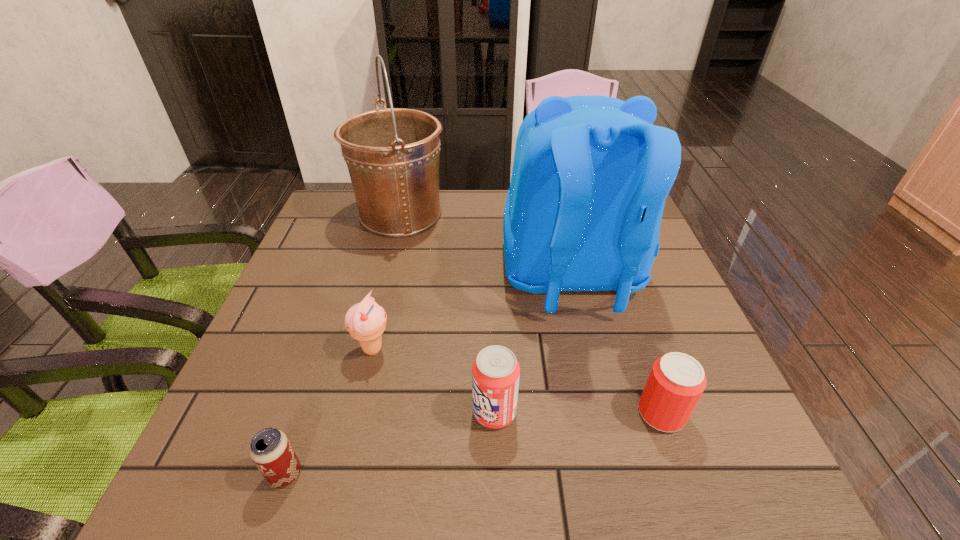
What are the coordinates of `free location located 0.260m on the front of the icecream` in the screenshot? It's located at (338, 496).

The width and height of the screenshot is (960, 540). I want to click on vacant region located 0.220m on the surface of the soda can, so click(x=353, y=412).

Identify the location of free point located on the surface of the soda can. (445, 412).

Where is `free space located on the surface of the soda can`? This screenshot has height=540, width=960. free space located on the surface of the soda can is located at coordinates (326, 412).

Identify the location of free space located 0.100m on the back of the farther beer can. (640, 353).

Where is `free spot located 0.350m on the right of the shortest object`? free spot located 0.350m on the right of the shortest object is located at coordinates (514, 474).

The height and width of the screenshot is (540, 960). I want to click on bucket located at the far edge, so click(392, 154).

In order to click on backpack located in the far edge section of the desktop in this screenshot , I will do tap(591, 173).

Image resolution: width=960 pixels, height=540 pixels. Identify the location of object located at the near edge. (270, 449).

This screenshot has height=540, width=960. Identify the location of bucket that is positioned at the left edge. (392, 154).